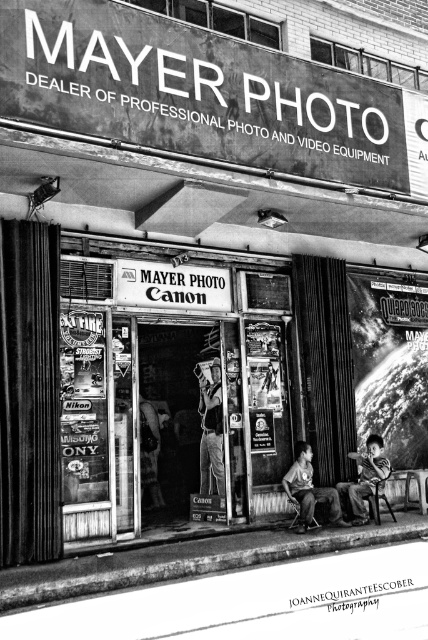
The width and height of the screenshot is (428, 640). What are the coordinates of `matte gray shirt at center` in the screenshot? It's located at (309, 490).

Is point (300, 452) in front of point (359, 464)?

That is True.

From the picture: Who is more distant from viewer, (297, 483) or (359, 524)?

The point (297, 483) is more distant.

Find the location of a particular element. The width and height of the screenshot is (428, 640). matte gray shirt at center is located at coordinates (309, 490).

Between metallic glass door at center and matte gray shirt at center, which one has less height?

matte gray shirt at center

Is point (64, 342) in front of point (300, 458)?

Yes.

Image resolution: width=428 pixels, height=640 pixels. What are the coordinates of `metallic glass door at center` in the screenshot? It's located at (174, 388).

Can you confirm if metallic signboard at upper center is positioned below black matte sign at center?

No, metallic signboard at upper center is not below black matte sign at center.

Between metallic signboard at upper center and black matte sign at center, which one has less height?

black matte sign at center

Does point (175, 92) come farther from viewer compared to point (228, 285)?

No.

Locate an element on the screen. The width and height of the screenshot is (428, 640). metallic signboard at upper center is located at coordinates (202, 93).